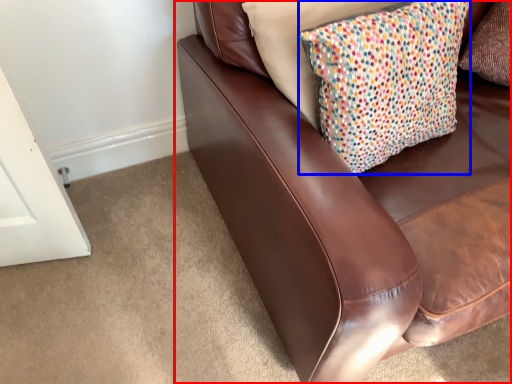
Question: Among these objects, which one is nearest to the camera, studio couch (highlighted by a red box) or pillow (highlighted by a blue box)?

Choices:
 (A) studio couch
 (B) pillow

Answer: (A)